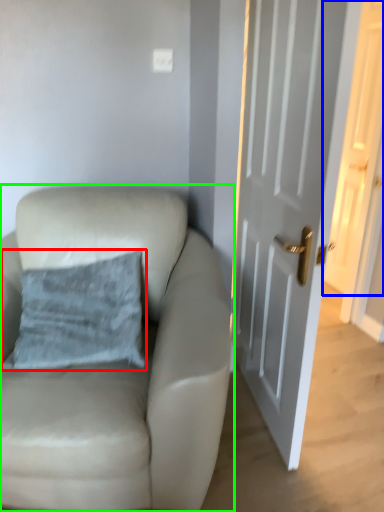
Question: Which object is the farthest from pillow (highlighted by a red box)? Choose among these: door (highlighted by a blue box) or chair (highlighted by a green box).

Choices:
 (A) door
 (B) chair

Answer: (A)